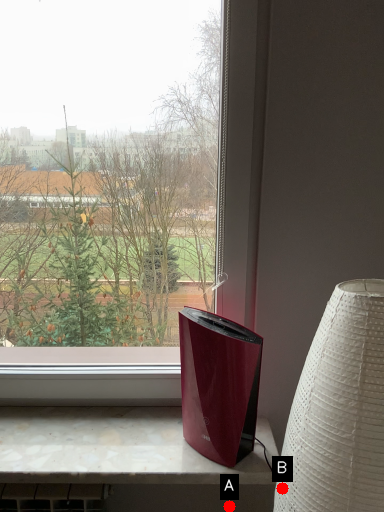
Question: Two points are circled on the image, labeled by A and B beside each circle. Among these points, which one is farthest from the camera?

Choices:
 (A) A is further
 (B) B is further

Answer: (A)